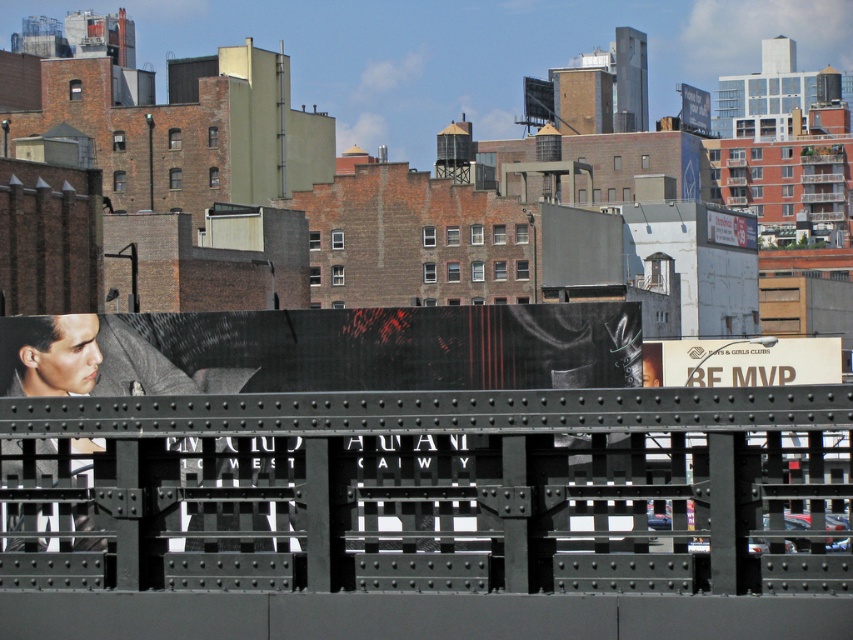
Question: Among these objects, which one is farthest from the camera?

Choices:
 (A) white cardboard sign at center
 (B) white glossy billboard at upper center

Answer: (B)

Question: Does white cardboard sign at center appear on the right side of white glossy billboard at upper center?

Choices:
 (A) yes
 (B) no

Answer: (B)

Question: Is white cardboard sign at center thinner than white glossy billboard at upper center?

Choices:
 (A) no
 (B) yes

Answer: (A)

Question: Is white cardboard sign at center above white glossy billboard at upper center?

Choices:
 (A) no
 (B) yes

Answer: (A)